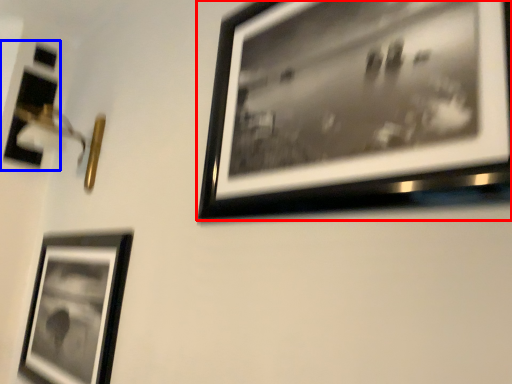
Question: Which object is closer to the camera taking this photo, picture frame (highlighted by a red box) or picture frame (highlighted by a blue box)?

Choices:
 (A) picture frame
 (B) picture frame

Answer: (A)